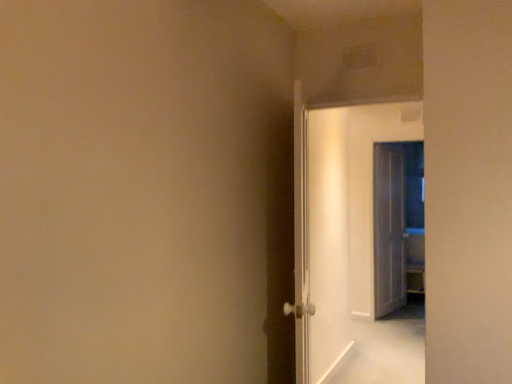
What do you see at coordinates (337, 220) in the screenshot?
I see `white glossy door at center, which appears as the second door when viewed from the back` at bounding box center [337, 220].

From the picture: Measure the distance between point (376, 213) and camera.

The distance of point (376, 213) from camera is 4.63 meters.

At what (x,y) coordinates should I click in order to perform the action: click on white glossy door at center, which is counted as the 1th door, starting from the left. Please return your answer as a coordinate pair (x, y). The image size is (512, 384). Looking at the image, I should click on pos(300,242).

Consider the image. What's the angular difference between white glossy door at center, acting as the second door starting from the front, and translucent glass door at right, positioned as the third door in left-to-right order,'s facing directions?

There is a 71.8-degree angle between the facing directions of white glossy door at center, acting as the second door starting from the front, and translucent glass door at right, positioned as the third door in left-to-right order.

Which point is more distant from viewer, (369, 292) or (397, 275)?

The point (397, 275) is behind.

Is white glossy door at center, acting as the second door starting from the front, not near translucent glass door at right, the 3th door positioned from the front?

white glossy door at center, acting as the second door starting from the front, is actually quite close to translucent glass door at right, the 3th door positioned from the front.

From the image's perspective, is white glossy door at center, acting as the 2th door starting from the left, located above translucent glass door at right, the 3th door positioned from the front?

Correct, white glossy door at center, acting as the 2th door starting from the left, appears higher than translucent glass door at right, the 3th door positioned from the front, in the image.

Based on the photo, is translucent glass door at right, positioned as the third door in left-to-right order, placed right next to white glossy door at center, which appears as the second door when viewed from the back?

No, translucent glass door at right, positioned as the third door in left-to-right order, is not beside white glossy door at center, which appears as the second door when viewed from the back.

In the scene shown: Which is more to the right, translucent glass door at right, the 3th door positioned from the front, or white glossy door at center, which is the 2th door from right to left?

translucent glass door at right, the 3th door positioned from the front, is more to the right.

Between translucent glass door at right, the 1th door from the back, and white glossy door at center, which appears as the second door when viewed from the back, which one has smaller size?

white glossy door at center, which appears as the second door when viewed from the back, is smaller.

Could you tell me if white glossy door at center, acting as the 2th door starting from the left, is facing white glossy door at center, which is counted as the 1th door, starting from the left?

Yes.

Can you confirm if white glossy door at center, which is the 2th door from right to left, is positioned to the right of white glossy door at center, which is the third door from back to front?

Yes.

Which of these two, white glossy door at center, which is the 2th door from right to left, or white glossy door at center, the third door viewed from the right, stands shorter?

white glossy door at center, the third door viewed from the right, is shorter.

Do you think white glossy door at center, which appears as the second door when viewed from the back, is within white glossy door at center, which is the third door from back to front, or outside of it?

The correct answer is: outside.

From a real-world perspective, relative to white glossy door at center, which is the third door from back to front, is translucent glass door at right, the 1th door from the back, vertically above or below?

From a real-world perspective, translucent glass door at right, the 1th door from the back, is physically below white glossy door at center, which is the third door from back to front.

Visually, is translucent glass door at right, the 3th door positioned from the front, positioned to the left or to the right of white glossy door at center, which is counted as the 1th door, starting from the left?

From the image, it's evident that translucent glass door at right, the 3th door positioned from the front, is to the right of white glossy door at center, which is counted as the 1th door, starting from the left.

Is translucent glass door at right, positioned as the third door in left-to-right order, inside the boundaries of white glossy door at center, the third door viewed from the right, or outside?

translucent glass door at right, positioned as the third door in left-to-right order, is outside white glossy door at center, the third door viewed from the right.

Which of these two, translucent glass door at right, the 3th door positioned from the front, or white glossy door at center, the third door viewed from the right, stands taller?

translucent glass door at right, the 3th door positioned from the front.

From the image's perspective, is white glossy door at center, which is counted as the 1th door, starting from the left, below translucent glass door at right, positioned as the third door in left-to-right order?

Actually, white glossy door at center, which is counted as the 1th door, starting from the left, appears above translucent glass door at right, positioned as the third door in left-to-right order, in the image.

From a real-world perspective, is white glossy door at center, which is the third door from back to front, below translucent glass door at right, the first door when ordered from right to left?

No, from a real-world perspective, white glossy door at center, which is the third door from back to front, is not beneath translucent glass door at right, the first door when ordered from right to left.

Can you confirm if white glossy door at center, placed as the first door when sorted from front to back, is smaller than translucent glass door at right, the first door when ordered from right to left?

Incorrect, white glossy door at center, placed as the first door when sorted from front to back, is not smaller in size than translucent glass door at right, the first door when ordered from right to left.

Is white glossy door at center, which is the third door from back to front, placed right next to translucent glass door at right, the 3th door positioned from the front?

white glossy door at center, which is the third door from back to front, and translucent glass door at right, the 3th door positioned from the front, are clearly separated.

What's the angular difference between white glossy door at center, placed as the first door when sorted from front to back, and white glossy door at center, acting as the second door starting from the front,'s facing directions?

They differ by 105 degrees in their facing directions.

From a real-world perspective, which is physically above, white glossy door at center, which is counted as the 1th door, starting from the left, or white glossy door at center, acting as the second door starting from the front?

white glossy door at center, acting as the second door starting from the front, from a real-world perspective.

From the image's perspective, which one is positioned higher, white glossy door at center, which is counted as the 1th door, starting from the left, or white glossy door at center, acting as the 2th door starting from the left?

white glossy door at center, acting as the 2th door starting from the left, is shown above in the image.

Would you say white glossy door at center, which is counted as the 1th door, starting from the left, contains white glossy door at center, which appears as the second door when viewed from the back?

Actually, white glossy door at center, which appears as the second door when viewed from the back, is outside white glossy door at center, which is counted as the 1th door, starting from the left.

From a real-world perspective, which door is the 2nd one above the translucent glass door at right, the 1th door from the back? Please provide its 2D coordinates.

[(337, 220)]

From the image's perspective, starting from the translucent glass door at right, the 1th door from the back, which door is the 2nd one above? Please provide its 2D coordinates.

[(337, 220)]

From the picture: Estimate the real-world distances between objects in this image. Which object is further from white glossy door at center, which is counted as the 1th door, starting from the left, white glossy door at center, which appears as the second door when viewed from the back, or translucent glass door at right, the first door when ordered from right to left?

translucent glass door at right, the first door when ordered from right to left, lies further to white glossy door at center, which is counted as the 1th door, starting from the left, than the other object.

Based on their spatial positions, is white glossy door at center, which is counted as the 1th door, starting from the left, or white glossy door at center, acting as the 2th door starting from the left, closer to translucent glass door at right, the 3th door positioned from the front?

white glossy door at center, acting as the 2th door starting from the left, is closer to translucent glass door at right, the 3th door positioned from the front.

Based on their spatial positions, is white glossy door at center, the third door viewed from the right, or translucent glass door at right, the 3th door positioned from the front, closer to white glossy door at center, acting as the second door starting from the front?

Among the two, white glossy door at center, the third door viewed from the right, is located nearer to white glossy door at center, acting as the second door starting from the front.

Considering their positions, is translucent glass door at right, the 1th door from the back, positioned further to white glossy door at center, acting as the second door starting from the front, than white glossy door at center, the third door viewed from the right?

translucent glass door at right, the 1th door from the back, lies further to white glossy door at center, acting as the second door starting from the front, than the other object.

When comparing their distances from translucent glass door at right, the 1th door from the back, does white glossy door at center, acting as the 2th door starting from the left, or white glossy door at center, placed as the first door when sorted from front to back, seem closer?

white glossy door at center, acting as the 2th door starting from the left, is positioned closer to the anchor translucent glass door at right, the 1th door from the back.

Looking at the image, which one is located closer to white glossy door at center, the third door viewed from the right, translucent glass door at right, positioned as the third door in left-to-right order, or white glossy door at center, acting as the 2th door starting from the left?

Based on the image, white glossy door at center, acting as the 2th door starting from the left, appears to be nearer to white glossy door at center, the third door viewed from the right.

Locate an element on the screen. door between white glossy door at center, which is counted as the 1th door, starting from the left, and translucent glass door at right, positioned as the third door in left-to-right order, along the z-axis is located at coordinates (337, 220).